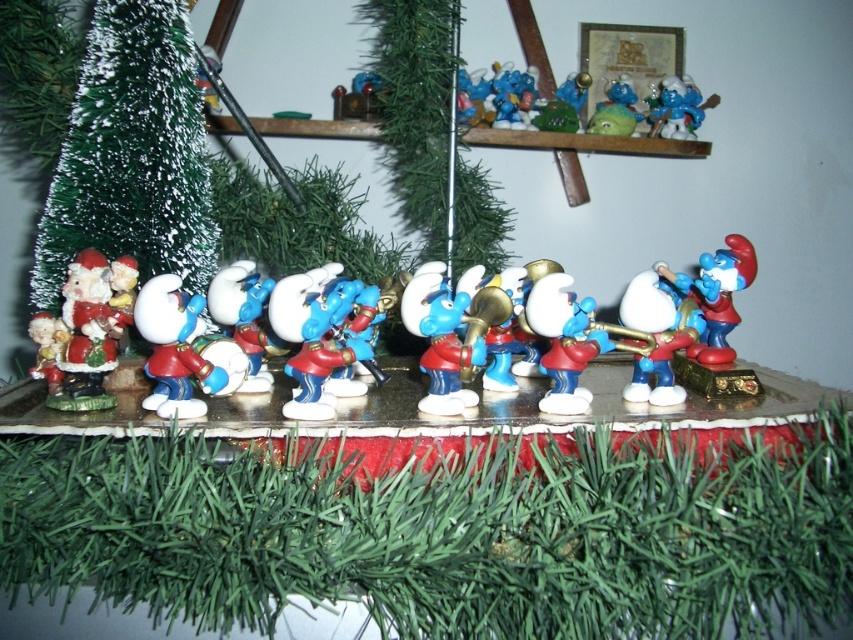
Question: Among these points, which one is farthest from the camera?

Choices:
 (A) (432, 170)
 (B) (561, 288)

Answer: (A)

Question: Where is green matte christmas tree at upper center located in relation to matte plastic smurf at center in the image?

Choices:
 (A) right
 (B) left

Answer: (A)

Question: Which object appears farthest from the camera in this image?

Choices:
 (A) matte plastic smurf at center
 (B) blue glossy smurf at center
 (C) green matte christmas tree at upper center
 (D) matte plastic santa at left

Answer: (C)

Question: Is green matte christmas tree at upper center wider than matte plastic smurf at center?

Choices:
 (A) no
 (B) yes

Answer: (B)

Question: Which of the following is the farthest from the observer?

Choices:
 (A) green frosted plastic christmas tree at left
 (B) matte plastic smurf at center
 (C) matte blue plastic smurf at right
 (D) matte plastic santa at left

Answer: (A)

Question: Can you confirm if matte plastic smurf at center is positioned to the right of blue glossy trumpet at center?

Choices:
 (A) no
 (B) yes

Answer: (A)